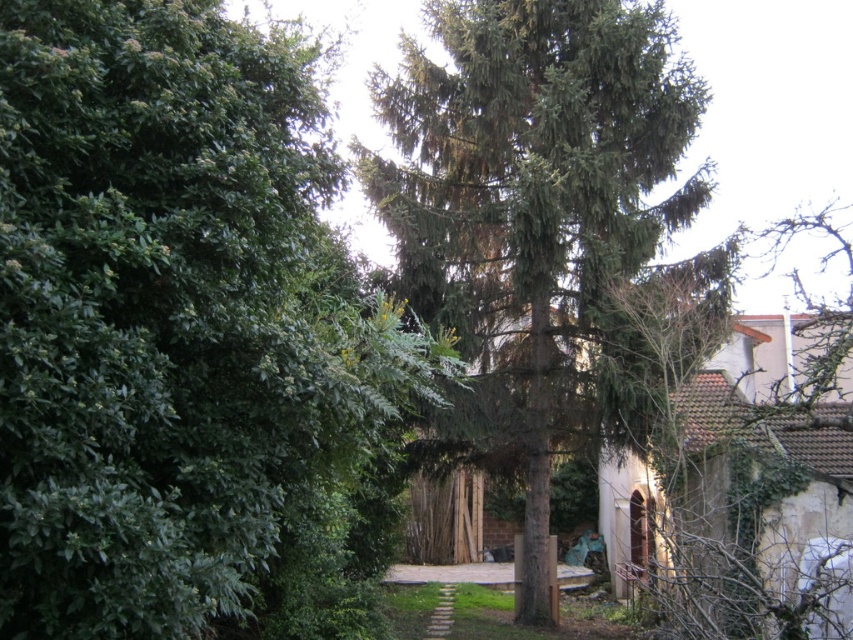
Is green leafy tree at left in front of green textured tree at center?

That is True.

Can you confirm if green leafy tree at left is wider than green textured tree at center?

No, green leafy tree at left is not wider than green textured tree at center.

Describe the element at coordinates (186, 337) in the screenshot. I see `green leafy tree at left` at that location.

Find the location of `green leafy tree at left`. green leafy tree at left is located at coordinates (186, 337).